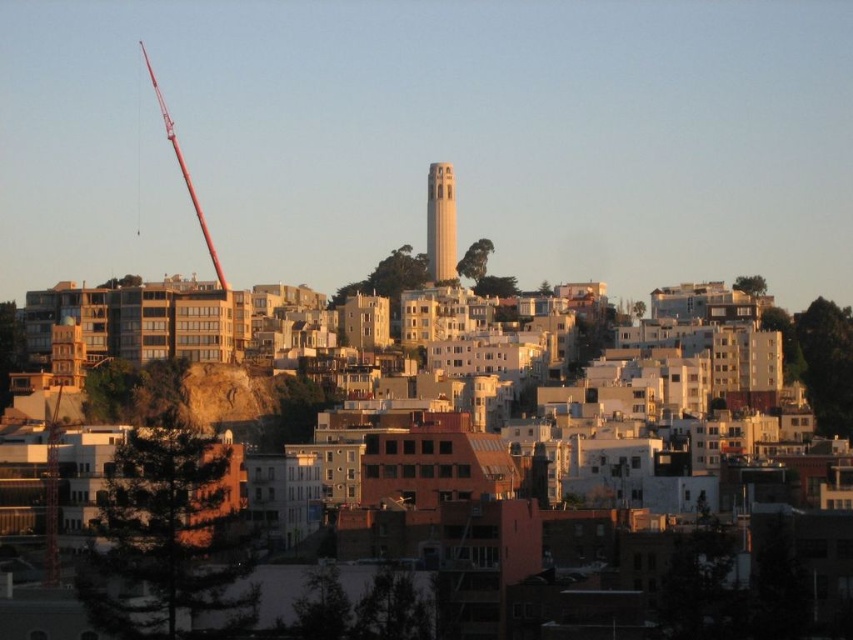
Is white concrete tower at center bigger than metallic red crane at left?

No, white concrete tower at center is not bigger than metallic red crane at left.

Identify the location of white concrete tower at center. This screenshot has width=853, height=640. 440,221.